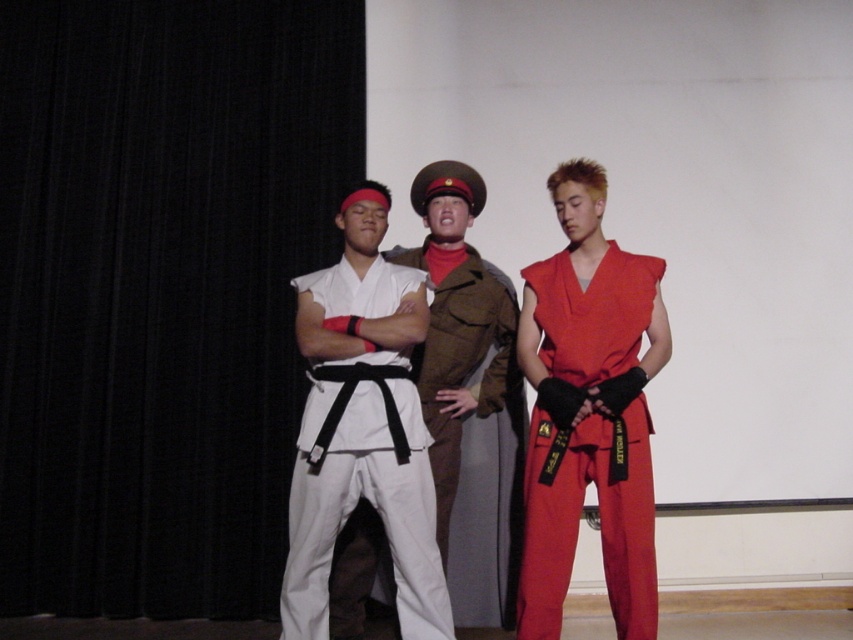
You are an observer standing in front of the stage. There are two points marked on the stage floor at coordinates point (601, 435) and point (491, 316). Which point is closer to you?

Point (601, 435) is closer to the viewer than point (491, 316).

You are a photographer setting up for a group photo. You notice the white matte karate uniform at center and the matte red jumpsuit at right. Which of these two outfits is positioned higher in the frame?

The white matte karate uniform at center is located above the matte red jumpsuit at right, so it is positioned higher in the frame.

You are a photographer setting up a tripod to take a group photo of the white matte karate uniform at center and the brown woolen uniform at center. Which person should you position closer to the front to ensure both are in focus?

The white matte karate uniform at center is shorter than the brown woolen uniform at center, so you should position the white matte karate uniform at center closer to the front to ensure both are in focus.